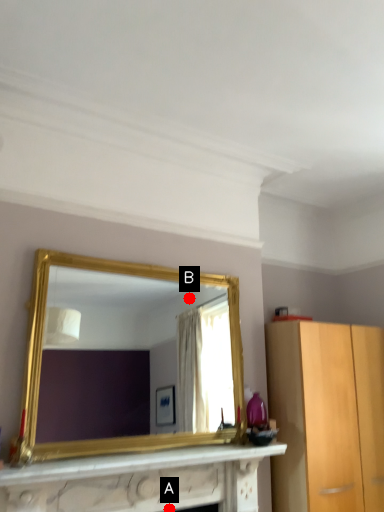
Question: Two points are circled on the image, labeled by A and B beside each circle. Which point appears farthest from the camera in this image?

Choices:
 (A) A is further
 (B) B is further

Answer: (B)